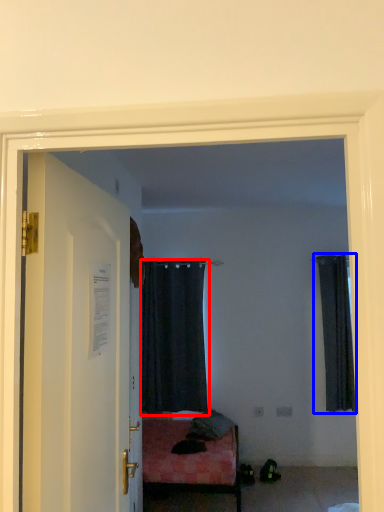
Question: Which of the following is the farthest to the observer, curtain (highlighted by a red box) or curtain (highlighted by a blue box)?

Choices:
 (A) curtain
 (B) curtain

Answer: (A)